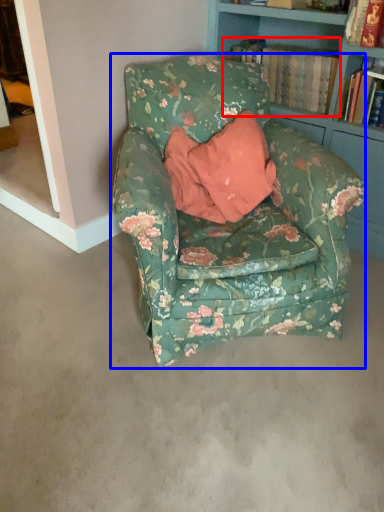
Question: Which object is further to the camera taking this photo, book (highlighted by a red box) or chair (highlighted by a blue box)?

Choices:
 (A) book
 (B) chair

Answer: (A)